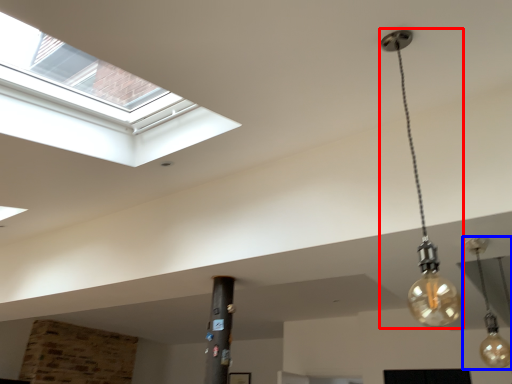
Question: Which of the following is the farthest to the observer, lamp (highlighted by a red box) or lamp (highlighted by a blue box)?

Choices:
 (A) lamp
 (B) lamp

Answer: (B)